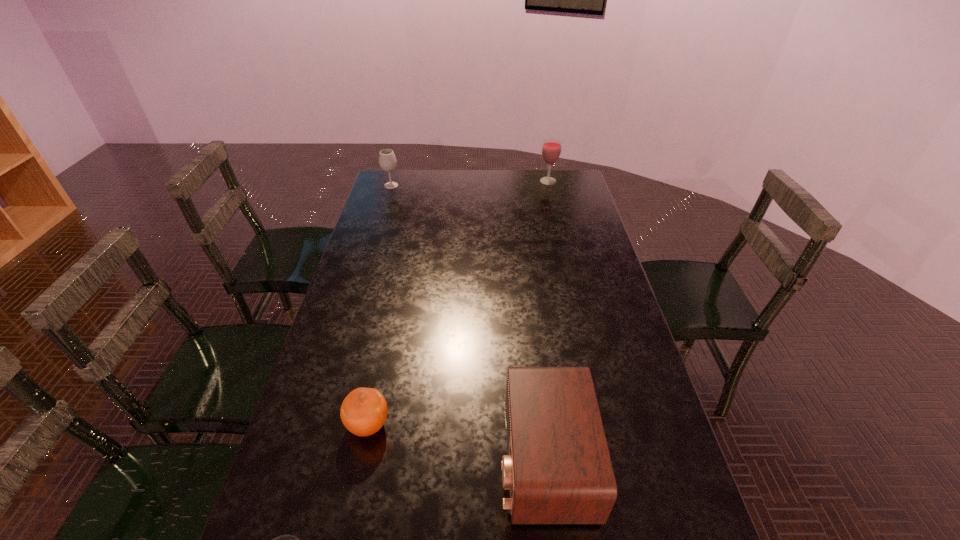
The width and height of the screenshot is (960, 540). I want to click on object positioned at the right edge, so click(551, 148).

You are a GUI agent. You are given a task and a screenshot of the screen. Output one action in this format:
    pyautogui.click(x=<x>, y=<y>)
    Task: Click on the object at the far left corner
    The height and width of the screenshot is (540, 960).
    Given the screenshot: What is the action you would take?
    pyautogui.click(x=387, y=160)

Where is `object that is at the far right corner`? Image resolution: width=960 pixels, height=540 pixels. object that is at the far right corner is located at coordinates (551, 148).

This screenshot has height=540, width=960. In order to click on vacant space at the far edge of the desktop in this screenshot , I will do `click(487, 187)`.

Image resolution: width=960 pixels, height=540 pixels. In the image, there is a desktop. Identify the location of free space at the left edge. click(x=374, y=272).

Find the location of a particular element. free point at the right edge is located at coordinates (573, 273).

This screenshot has height=540, width=960. Identify the location of vacant region at the far left corner of the desktop. (388, 181).

You are a GUI agent. You are given a task and a screenshot of the screen. Output one action in this format:
    pyautogui.click(x=<x>, y=<y>)
    Task: Click on the vacant space that's between the shortest object and the rightmost wineglass
    The height and width of the screenshot is (540, 960).
    Given the screenshot: What is the action you would take?
    pyautogui.click(x=458, y=303)

The height and width of the screenshot is (540, 960). I want to click on free space between the radio receiver and the orange, so click(457, 442).

Find the location of a particular element. Image resolution: width=960 pixels, height=540 pixels. vacant space that's between the shortest object and the rightmost wineglass is located at coordinates 458,303.